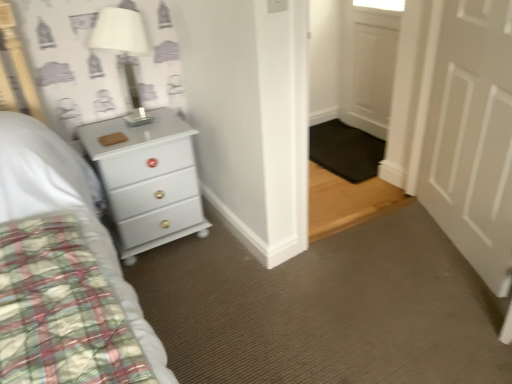
This screenshot has height=384, width=512. Describe the element at coordinates (372, 72) in the screenshot. I see `white wooden door at upper right, the second door positioned from the front` at that location.

What do you see at coordinates (469, 133) in the screenshot? I see `white matte door at right, which is the first door from front to back` at bounding box center [469, 133].

Identify the location of white matte lampshade at upper left. 120,31.

In the scene shown: Who is shorter, white wooden door at upper right, the 1th door from the back, or white matte lampshade at upper left?

white matte lampshade at upper left is shorter.

Considering the sizes of objects white wooden door at upper right, the second door positioned from the front, and white matte lampshade at upper left in the image provided, who is thinner, white wooden door at upper right, the second door positioned from the front, or white matte lampshade at upper left?

white wooden door at upper right, the second door positioned from the front.

Is point (387, 71) farther from camera compared to point (132, 125)?

Yes, it is behind point (132, 125).

From the image's perspective, which is above, white wooden door at upper right, the second door positioned from the front, or white matte lampshade at upper left?

white wooden door at upper right, the second door positioned from the front, appears higher in the image.

Is white matte lampshade at upper left taller or shorter than white glossy chest of drawers at left?

Considering their sizes, white matte lampshade at upper left has less height than white glossy chest of drawers at left.

From the image's perspective, which one is positioned lower, white matte lampshade at upper left or white glossy chest of drawers at left?

white glossy chest of drawers at left appears lower in the image.

You are a GUI agent. You are given a task and a screenshot of the screen. Output one action in this format:
    pyautogui.click(x=<x>, y=<y>)
    Task: Click on the chest of drawers below the white matte lampshade at upper left (from a real-world perspective)
    This screenshot has height=384, width=512.
    Given the screenshot: What is the action you would take?
    pyautogui.click(x=147, y=179)

Which object is positioned more to the right, white matte lampshade at upper left or white glossy chest of drawers at left?

From the viewer's perspective, white glossy chest of drawers at left appears more on the right side.

From the image's perspective, is white glossy chest of drawers at left located above or below white wooden door at upper right, the 1th door from the back?

Based on their image positions, white glossy chest of drawers at left is located beneath white wooden door at upper right, the 1th door from the back.

Considering the positions of points (114, 151) and (368, 108), is point (114, 151) closer to camera compared to point (368, 108)?

Yes, point (114, 151) is in front of point (368, 108).

Considering the relative positions of white glossy chest of drawers at left and white wooden door at upper right, the second door positioned from the front, in the image provided, is white glossy chest of drawers at left behind white wooden door at upper right, the second door positioned from the front,?

No, it is not.

From a real-world perspective, which object stands above the other?

From a 3D spatial view, white wooden door at upper right, the second door positioned from the front, is above.

From the picture: Between white glossy chest of drawers at left and white matte door at right, which is counted as the second door, starting from the back, which one has larger width?

With larger width is white glossy chest of drawers at left.

Is white glossy chest of drawers at left not within white matte door at right, which is the first door from front to back?

white glossy chest of drawers at left is positioned outside white matte door at right, which is the first door from front to back.

Which object is positioned more to the right, white glossy chest of drawers at left or white matte door at right, which is counted as the second door, starting from the back?

Positioned to the right is white matte door at right, which is counted as the second door, starting from the back.

Considering the sizes of white glossy chest of drawers at left and white matte door at right, which is the first door from front to back, in the image, is white glossy chest of drawers at left bigger or smaller than white matte door at right, which is the first door from front to back,?

Considering their sizes, white glossy chest of drawers at left takes up more space than white matte door at right, which is the first door from front to back.

Would you say white matte door at right, which is the first door from front to back, is outside white matte lampshade at upper left?

Yes, white matte door at right, which is the first door from front to back, is located beyond the bounds of white matte lampshade at upper left.

Is white matte door at right, which is the first door from front to back, oriented towards white matte lampshade at upper left?

Yes, white matte door at right, which is the first door from front to back, is aimed at white matte lampshade at upper left.

Which of these two, white matte door at right, which is counted as the second door, starting from the back, or white matte lampshade at upper left, stands taller?

With more height is white matte door at right, which is counted as the second door, starting from the back.

From a real-world perspective, which is physically below, white matte door at right, which is the first door from front to back, or white matte lampshade at upper left?

white matte door at right, which is the first door from front to back, is physically lower.

Is point (435, 48) more distant than point (377, 70)?

That is False.

This screenshot has width=512, height=384. I want to click on door to the left of white matte door at right, which is the first door from front to back, so click(x=372, y=72).

Considering the relative sizes of white matte door at right, which is the first door from front to back, and white wooden door at upper right, the 1th door from the back, in the image provided, is white matte door at right, which is the first door from front to back, thinner than white wooden door at upper right, the 1th door from the back,?

No, white matte door at right, which is the first door from front to back, is not thinner than white wooden door at upper right, the 1th door from the back.

From the picture: Which object is positioned more to the left, white matte door at right, which is the first door from front to back, or white wooden door at upper right, the 1th door from the back?

white wooden door at upper right, the 1th door from the back, is more to the left.

Would you consider white wooden door at upper right, the 1th door from the back, to be distant from white matte door at right, which is the first door from front to back?

white wooden door at upper right, the 1th door from the back, is far away from white matte door at right, which is the first door from front to back.

Is white wooden door at upper right, the second door positioned from the front, surrounding white matte door at right, which is the first door from front to back?

No, white wooden door at upper right, the second door positioned from the front, does not contain white matte door at right, which is the first door from front to back.

From a real-world perspective, does white wooden door at upper right, the second door positioned from the front, stand above white matte door at right, which is the first door from front to back?

Actually, white wooden door at upper right, the second door positioned from the front, is physically below white matte door at right, which is the first door from front to back, in the real world.

Which of these two, white wooden door at upper right, the second door positioned from the front, or white matte door at right, which is the first door from front to back, is wider?

With larger width is white matte door at right, which is the first door from front to back.

I want to click on lamp below the white wooden door at upper right, the 1th door from the back (from the image's perspective), so click(120, 31).

This screenshot has width=512, height=384. In order to click on lamp above the white glossy chest of drawers at left (from the image's perspective) in this screenshot , I will do `click(120, 31)`.

Estimate the real-world distances between objects in this image. Which object is closer to white wooden door at upper right, the second door positioned from the front, white glossy chest of drawers at left or white matte door at right, which is counted as the second door, starting from the back?

white matte door at right, which is counted as the second door, starting from the back, is closer to white wooden door at upper right, the second door positioned from the front.

Based on their spatial positions, is white matte door at right, which is the first door from front to back, or white matte lampshade at upper left further from white wooden door at upper right, the second door positioned from the front?

white matte lampshade at upper left is further to white wooden door at upper right, the second door positioned from the front.

Estimate the real-world distances between objects in this image. Which object is closer to white matte lampshade at upper left, white glossy chest of drawers at left or white matte door at right, which is counted as the second door, starting from the back?

white glossy chest of drawers at left is closer to white matte lampshade at upper left.

When comparing their distances from white glossy chest of drawers at left, does white matte lampshade at upper left or white matte door at right, which is the first door from front to back, seem further?

white matte door at right, which is the first door from front to back, is further to white glossy chest of drawers at left.

Looking at the image, which one is located further to white glossy chest of drawers at left, white wooden door at upper right, the second door positioned from the front, or white matte door at right, which is counted as the second door, starting from the back?

white wooden door at upper right, the second door positioned from the front, is positioned further to the anchor white glossy chest of drawers at left.

Based on their spatial positions, is white matte lampshade at upper left or white glossy chest of drawers at left closer to white wooden door at upper right, the second door positioned from the front?

The object closer to white wooden door at upper right, the second door positioned from the front, is white glossy chest of drawers at left.

Looking at the image, which one is located closer to white wooden door at upper right, the second door positioned from the front, white matte door at right, which is counted as the second door, starting from the back, or white glossy chest of drawers at left?

Based on the image, white matte door at right, which is counted as the second door, starting from the back, appears to be nearer to white wooden door at upper right, the second door positioned from the front.

From the image, which object appears to be farther from white matte door at right, which is the first door from front to back, white glossy chest of drawers at left or white wooden door at upper right, the 1th door from the back?

white glossy chest of drawers at left is further to white matte door at right, which is the first door from front to back.

Locate an element on the screen. door between white matte lampshade at upper left and white matte door at right, which is the first door from front to back, in the horizontal direction is located at coordinates (372, 72).

You are a GUI agent. You are given a task and a screenshot of the screen. Output one action in this format:
    pyautogui.click(x=<x>, y=<y>)
    Task: Click on the door between white glossy chest of drawers at left and white matte door at right, which is the first door from front to back, in the horizontal direction
    The image size is (512, 384).
    Given the screenshot: What is the action you would take?
    [372, 72]

Locate an element on the screen. Image resolution: width=512 pixels, height=384 pixels. the chest of drawers located between white matte lampshade at upper left and white matte door at right, which is the first door from front to back, in the left-right direction is located at coordinates (147, 179).

Locate an element on the screen. The width and height of the screenshot is (512, 384). chest of drawers between white matte lampshade at upper left and white wooden door at upper right, the 1th door from the back is located at coordinates (147, 179).